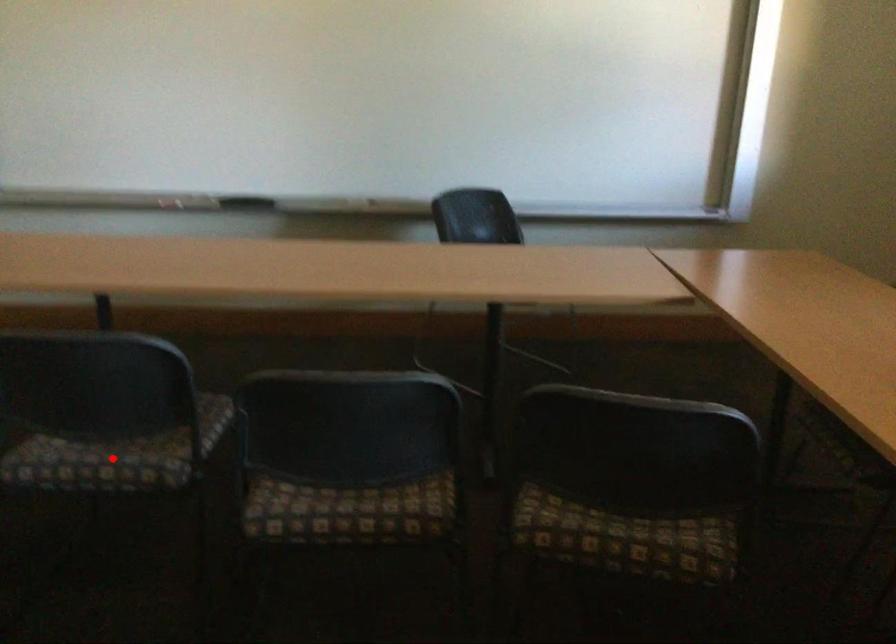
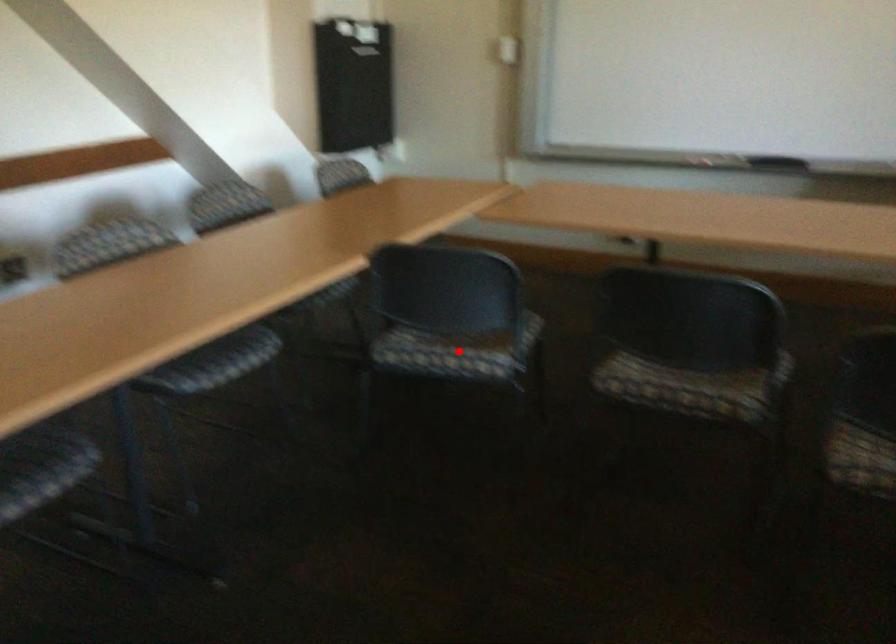
Consider the image. I am providing you with two images of the same scene from different viewpoints. A red point is marked on the first image and another point is marked on the second image. Are the points marked in image1 and image2 representing the same 3D position?

No